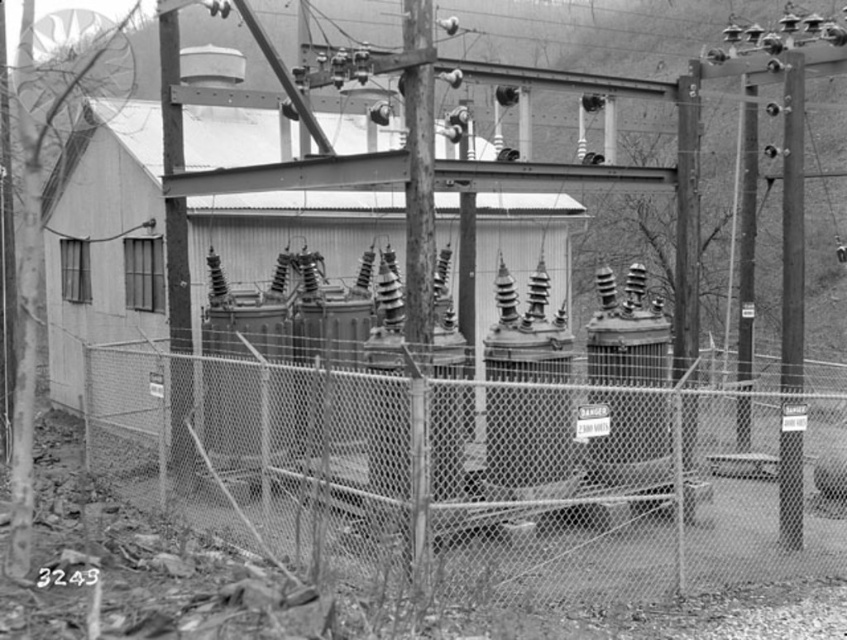
Question: Which point is farther to the camera?

Choices:
 (A) chain link fence at center
 (B) metallic gray pole at right
 (C) smooth metal pole at upper left
 (D) metallic pole at right

Answer: (C)

Question: Among these points, which one is farthest from the camera?

Choices:
 (A) (176, 317)
 (B) (792, 444)
 (C) (745, 332)

Answer: (C)

Question: Can you confirm if metallic gray pole at right is bigger than smooth metal pole at upper left?

Choices:
 (A) no
 (B) yes

Answer: (A)

Question: Does chain link fence at center have a lesser width compared to metallic pole at right?

Choices:
 (A) no
 (B) yes

Answer: (B)

Question: Can you confirm if smooth metal pole at upper left is bigger than metallic pole at right?

Choices:
 (A) no
 (B) yes

Answer: (A)

Question: Which point is closer to the camera?

Choices:
 (A) (173, 129)
 (B) (740, 257)

Answer: (A)